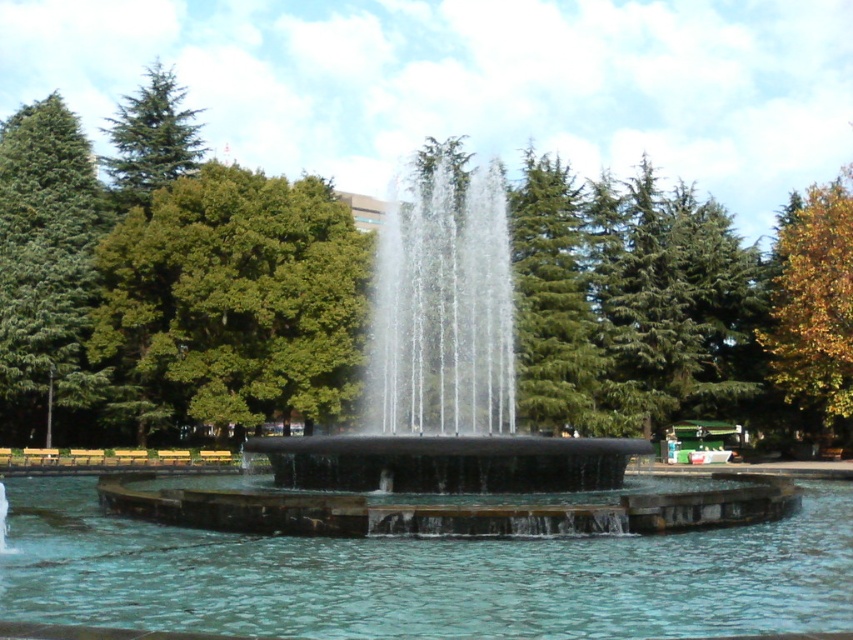
Question: Estimate the real-world distances between objects in this image. Which object is closer to the green textured tree at upper center?

Choices:
 (A) green needle-like tree at upper left
 (B) clear water at center
 (C) black polished water at center
 (D) green matte tree at left

Answer: (C)

Question: Can you confirm if green coniferous tree at upper center is positioned below green textured tree at upper center?

Choices:
 (A) no
 (B) yes

Answer: (B)

Question: Is clear water at center to the left of green textured tree at upper center from the viewer's perspective?

Choices:
 (A) yes
 (B) no

Answer: (A)

Question: Which object is the farthest from the green needle-like tree at upper left?

Choices:
 (A) green leafy tree at center
 (B) clear water at center
 (C) green matte tree at left
 (D) green textured tree at upper center

Answer: (B)

Question: Among these points, which one is nearest to the camera?

Choices:
 (A) (129, 225)
 (B) (592, 632)
 (C) (732, 232)

Answer: (B)

Question: Is green leafy tree at center above green needle-like tree at upper left?

Choices:
 (A) yes
 (B) no

Answer: (B)